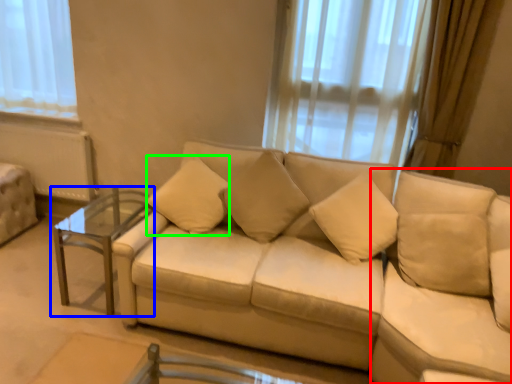
Question: Estimate the real-world distances between objects in this image. Which object is farther from swivel chair (highlighted by a red box), table (highlighted by a blue box) or pillow (highlighted by a green box)?

Choices:
 (A) table
 (B) pillow

Answer: (A)